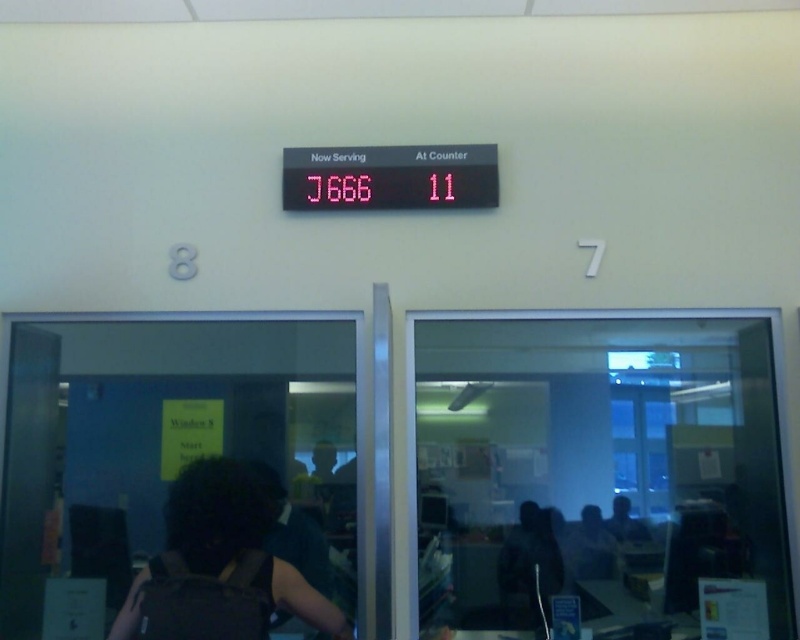
Question: Which of the following is the closest to the observer?

Choices:
 (A) (536, 618)
 (B) (264, 524)
 (C) (616, 557)

Answer: (A)

Question: Estimate the real-world distances between objects in this image. Which object is farther from the transparent glass door at right?

Choices:
 (A) dark brown hair at center
 (B) transparent glass door at lower left
 (C) black matte person at lower right

Answer: (B)

Question: Is dark brown backpack at lower left to the left of silhouette figure at center from the viewer's perspective?

Choices:
 (A) no
 (B) yes

Answer: (B)

Question: Does red led sign at center come in front of black matte person at lower right?

Choices:
 (A) no
 (B) yes

Answer: (A)

Question: Among these points, which one is farthest from the camera?

Choices:
 (A) (193, 493)
 (B) (322, 401)

Answer: (B)

Question: Does transparent glass door at right appear on the left side of silhouette figure at center?

Choices:
 (A) yes
 (B) no

Answer: (A)